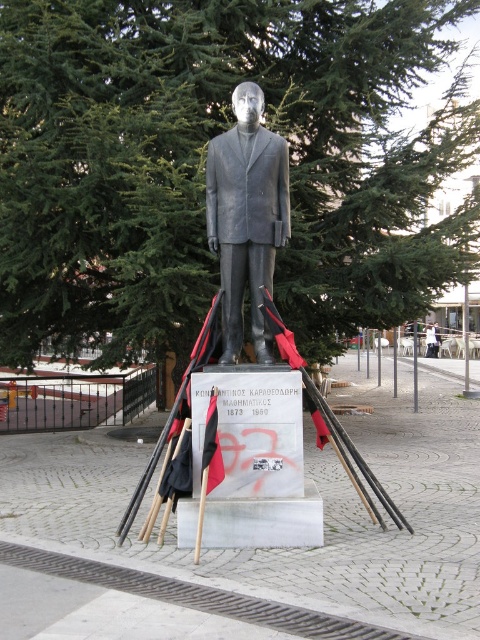
Does green needle-like leaves at center have a lesser width compared to bronze statue at center?

Correct, green needle-like leaves at center's width is less than bronze statue at center's.

Who is more distant from viewer, (x=147, y=38) or (x=207, y=224)?

The point (x=147, y=38) is more distant.

Between point (97, 259) and point (237, 314), which one is positioned behind?

The point (97, 259) is more distant.

Find the location of a particular element. The height and width of the screenshot is (640, 480). green needle-like leaves at center is located at coordinates (204, 163).